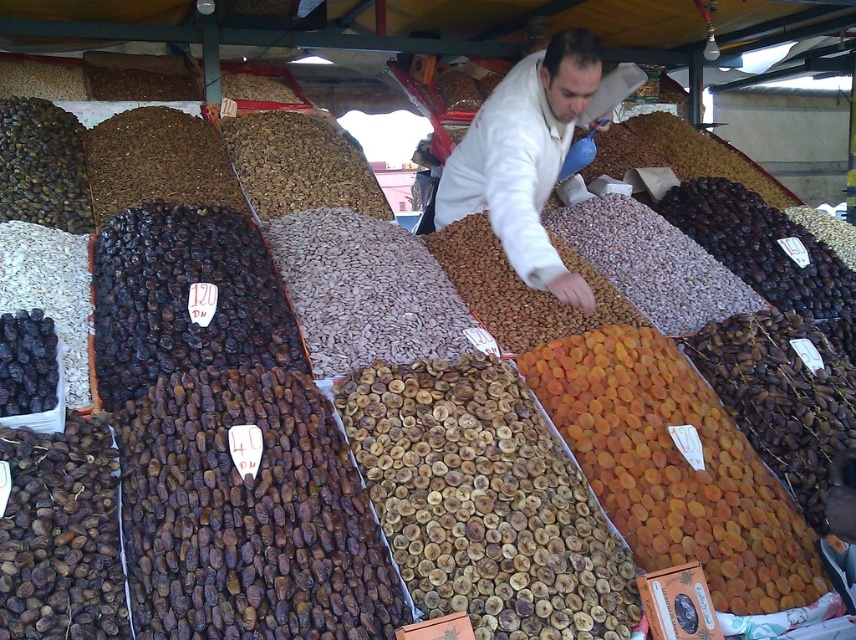
You are a customer at the market stall. You see the orange dried apricot at center and the white matte jacket at center. Which item is positioned lower in the display?

The orange dried apricot at center is located below the white matte jacket at center, so it is positioned lower in the display.

You are a customer at the market stall and want to pick up the orange dried apricot at center and the white matte jacket at center. Which one is closer to you?

The orange dried apricot at center is closer to you since it is in front of the white matte jacket at center.

You are a customer at the market stall and see both the orange dried apricot at center and the white matte jacket at center. Which item is positioned more to the right side?

The orange dried apricot at center is positioned more to the right side than the white matte jacket at center.